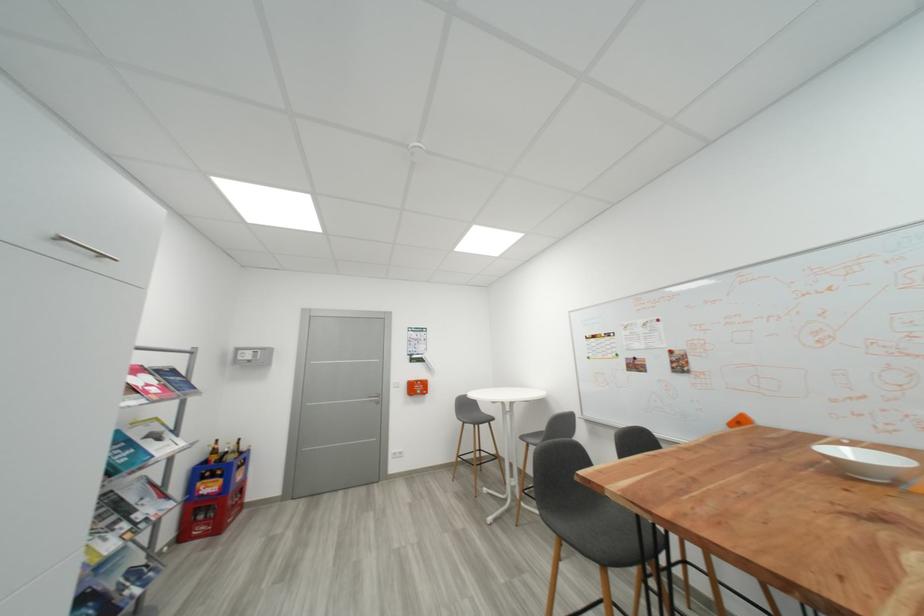
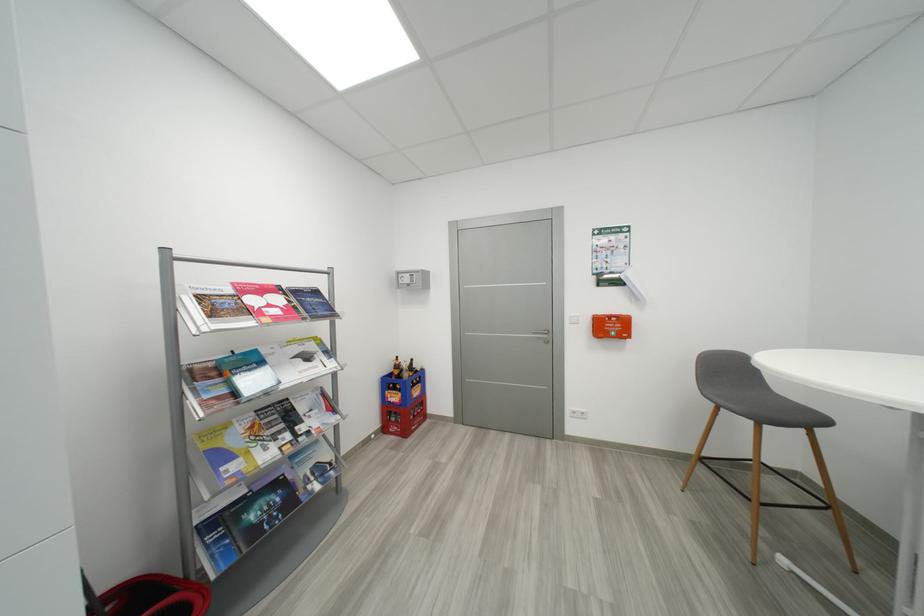
The point at [424,390] is marked in the first image. Where is the corresponding point in the second image?

(617, 330)